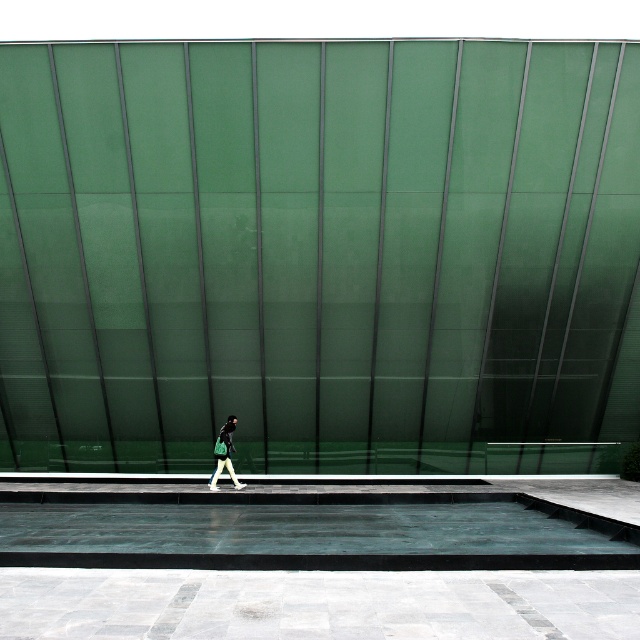
You are standing at the edge of the smooth concrete pool at center and want to place the matte black jacket at center on the opposite side. Can you estimate if the jacket will fit entirely within the pool without any part hanging over?

The smooth concrete pool at center might be wider than matte black jacket at center, so there is a possibility that the jacket will fit within the pool without overhanging. However, the exact dimensions are uncertain based on the provided information.

You are standing on the paved area and want to place a 2.5 meter long ladder between the smooth concrete pool at center and the matte black jacket at center. Is there enough space between them to fit the ladder horizontally?

The smooth concrete pool at center is 3.32 meters away from the matte black jacket at center. Since the ladder is 2.5 meters long, there is enough space between them to fit the ladder horizontally.

Looking at this image, you are standing on the paved area and want to walk to the smooth concrete pool at center. Which direction should you walk relative to the matte black jacket at center?

You should walk towards the smooth concrete pool at center, which is in front of the matte black jacket at center, so the direction would be forward relative to the matte black jacket at center.